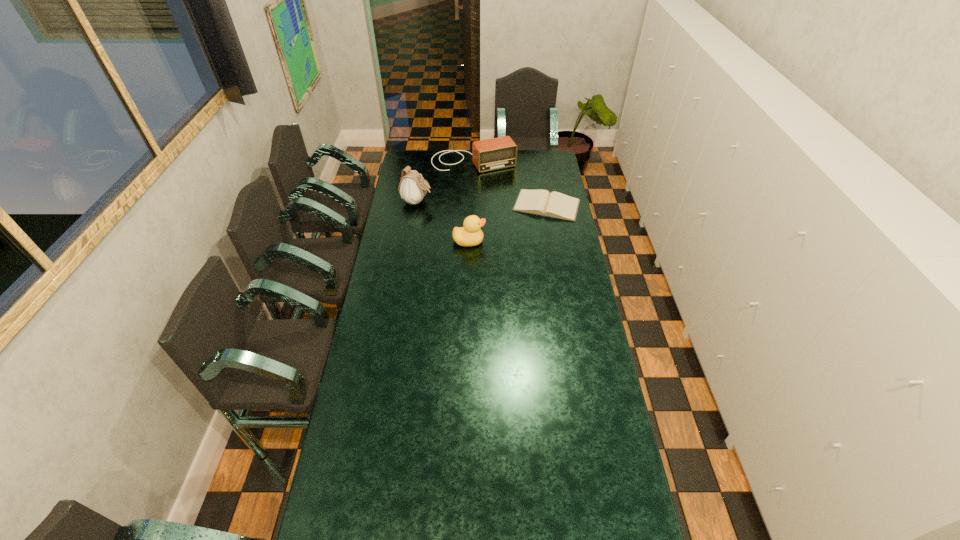
Image resolution: width=960 pixels, height=540 pixels. I want to click on the nearest object, so click(470, 234).

In order to click on Bible in this screenshot , I will do `click(539, 202)`.

The height and width of the screenshot is (540, 960). Find the location of `pouch`. pouch is located at coordinates (412, 188).

This screenshot has height=540, width=960. Identify the location of the farthest object. (497, 153).

You are a GUI agent. You are given a task and a screenshot of the screen. Output one action in this format:
    pyautogui.click(x=<x>, y=<y>)
    Task: Click on the blank space located 0.240m at the beak of the duck
    
    Given the screenshot: What is the action you would take?
    pyautogui.click(x=535, y=241)

Find the location of a particular element. The height and width of the screenshot is (540, 960). vacant region located 0.120m on the front of the Bible is located at coordinates (552, 238).

Locate an element on the screen. Image resolution: width=960 pixels, height=540 pixels. free region located 0.400m on the front-facing side of the tallest object is located at coordinates (504, 218).

Locate an element on the screen. The image size is (960, 540). vacant region located on the front-facing side of the tallest object is located at coordinates (460, 210).

Locate an element on the screen. This screenshot has width=960, height=540. vacant area situated on the front-facing side of the tallest object is located at coordinates (453, 208).

Image resolution: width=960 pixels, height=540 pixels. Identify the location of vacant area located on the front-facing side of the radio receiver. (495, 186).